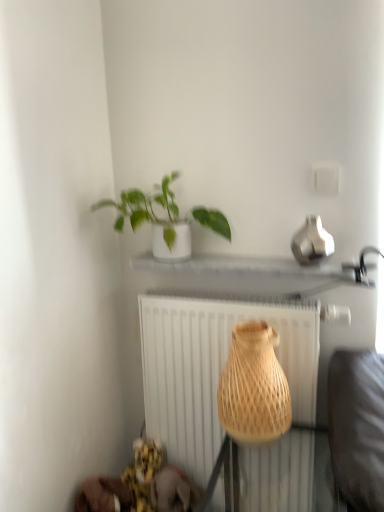
Question: Is green matte plant at upper center at the left side of white textured radiator at center?

Choices:
 (A) yes
 (B) no

Answer: (A)

Question: Is white textured radiator at center located within green matte plant at upper center?

Choices:
 (A) yes
 (B) no

Answer: (B)

Question: Does green matte plant at upper center have a larger size compared to white textured radiator at center?

Choices:
 (A) no
 (B) yes

Answer: (A)

Question: Considering the relative sizes of green matte plant at upper center and white textured radiator at center in the image provided, is green matte plant at upper center shorter than white textured radiator at center?

Choices:
 (A) no
 (B) yes

Answer: (B)

Question: Is green matte plant at upper center oriented towards white textured radiator at center?

Choices:
 (A) no
 (B) yes

Answer: (A)

Question: Is natural woven vase at center in front of or behind white textured radiator at center in the image?

Choices:
 (A) behind
 (B) front

Answer: (B)

Question: Would you say natural woven vase at center is to the left or to the right of white textured radiator at center in the picture?

Choices:
 (A) right
 (B) left

Answer: (A)

Question: Based on their sizes in the image, would you say natural woven vase at center is bigger or smaller than white textured radiator at center?

Choices:
 (A) big
 (B) small

Answer: (B)

Question: From the image's perspective, is natural woven vase at center above or below white textured radiator at center?

Choices:
 (A) above
 (B) below

Answer: (A)

Question: Considering the positions of natural woven vase at center and green matte plant at upper center in the image, is natural woven vase at center taller or shorter than green matte plant at upper center?

Choices:
 (A) short
 (B) tall

Answer: (B)

Question: Considering their positions, is natural woven vase at center located in front of or behind green matte plant at upper center?

Choices:
 (A) behind
 (B) front

Answer: (B)

Question: From the image's perspective, relative to green matte plant at upper center, is natural woven vase at center above or below?

Choices:
 (A) below
 (B) above

Answer: (A)

Question: Is natural woven vase at center wider or thinner than green matte plant at upper center?

Choices:
 (A) thin
 (B) wide

Answer: (B)

Question: Is green matte plant at upper center situated inside white textured radiator at center or outside?

Choices:
 (A) outside
 (B) inside

Answer: (A)

Question: From the image's perspective, is green matte plant at upper center above or below white textured radiator at center?

Choices:
 (A) below
 (B) above

Answer: (B)